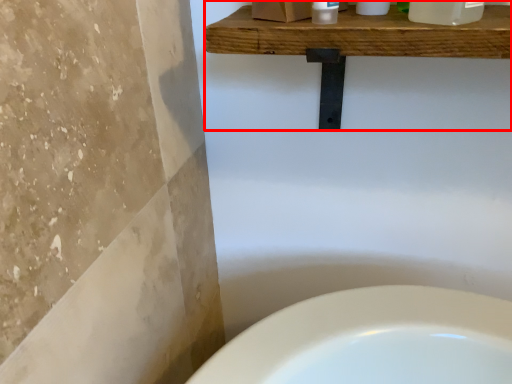
Question: Observing the image, what is the correct spatial positioning of balustrade (annotated by the red box) in reference to cleaning product?

Choices:
 (A) left
 (B) right

Answer: (A)